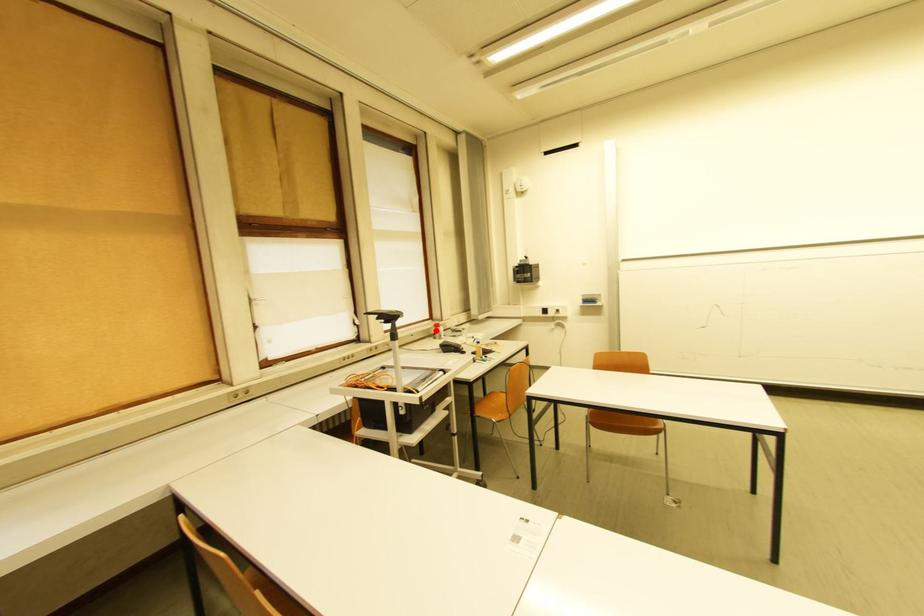
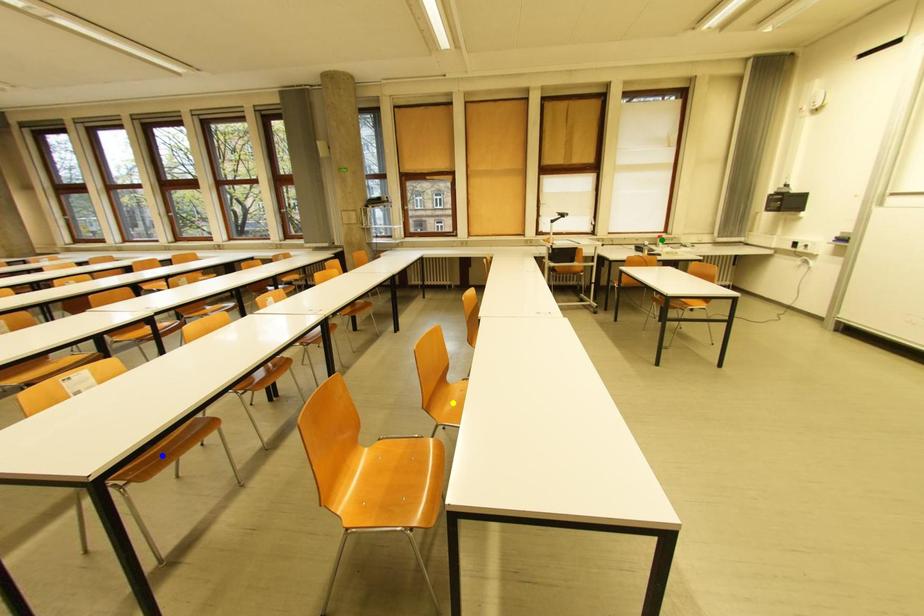
Question: I am providing you with two images of the same scene from different viewpoints. A red point is marked on the first image. You are given multiple points on the second image. Which point in image 2 represents the same 3d spot as the red point in image 1?

Choices:
 (A) green point
 (B) blue point
 (C) yellow point

Answer: (A)